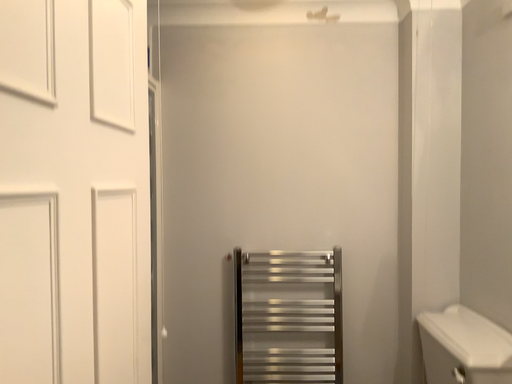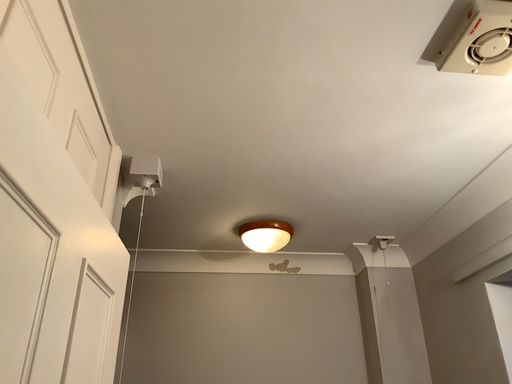
Question: Which way did the camera rotate in the video?

Choices:
 (A) rotated upward
 (B) rotated downward

Answer: (A)